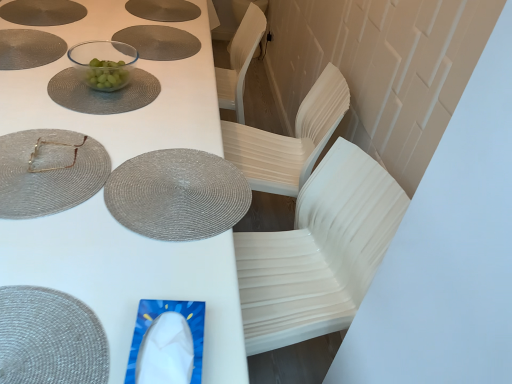
This screenshot has width=512, height=384. Find the location of `free space to the back side of transparent glass bowl at upper center, the 1th glass plate positioned from the top`. free space to the back side of transparent glass bowl at upper center, the 1th glass plate positioned from the top is located at coordinates (116, 50).